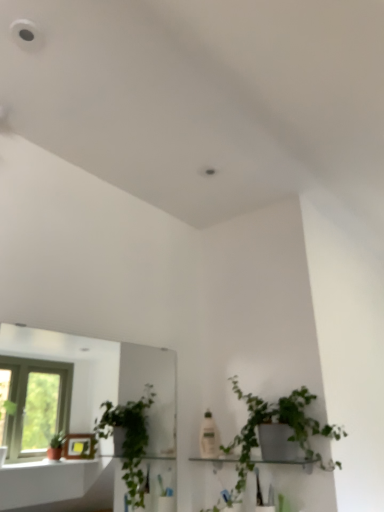
Question: From the image's perspective, is clear glass mirror at left beneath green matte plant at center-right?

Choices:
 (A) yes
 (B) no

Answer: (B)

Question: Considering the relative positions of clear glass mirror at left and green matte plant at center-right in the image provided, is clear glass mirror at left to the right of green matte plant at center-right from the viewer's perspective?

Choices:
 (A) yes
 (B) no

Answer: (B)

Question: Is clear glass mirror at left facing away from green matte plant at center-right?

Choices:
 (A) no
 (B) yes

Answer: (A)

Question: Is clear glass mirror at left next to green matte plant at center-right?

Choices:
 (A) no
 (B) yes

Answer: (A)

Question: Can you confirm if clear glass mirror at left is shorter than green matte plant at center-right?

Choices:
 (A) no
 (B) yes

Answer: (A)

Question: Based on their positions, is clear glass mirror at left located to the left or right of green matte plant at center-right?

Choices:
 (A) right
 (B) left

Answer: (B)

Question: From a real-world perspective, relative to green matte plant at center-right, is clear glass mirror at left vertically above or below?

Choices:
 (A) above
 (B) below

Answer: (A)

Question: Does point (82, 377) appear closer or farther from the camera than point (281, 411)?

Choices:
 (A) farther
 (B) closer

Answer: (A)

Question: Considering the positions of clear glass mirror at left and green matte plant at center-right in the image, is clear glass mirror at left wider or thinner than green matte plant at center-right?

Choices:
 (A) thin
 (B) wide

Answer: (A)

Question: Considering their positions, is white glossy shelf at center located in front of or behind clear glass mirror at left?

Choices:
 (A) front
 (B) behind

Answer: (B)

Question: Visually, is white glossy shelf at center positioned to the left or to the right of clear glass mirror at left?

Choices:
 (A) left
 (B) right

Answer: (B)

Question: Looking at the image, does white glossy shelf at center seem bigger or smaller compared to clear glass mirror at left?

Choices:
 (A) small
 (B) big

Answer: (A)

Question: Choose the correct answer: Is white glossy shelf at center inside clear glass mirror at left or outside it?

Choices:
 (A) inside
 (B) outside

Answer: (B)

Question: From the image's perspective, is clear glass mirror at left above or below white glossy shelf at center?

Choices:
 (A) above
 (B) below

Answer: (A)

Question: Relative to white glossy shelf at center, is clear glass mirror at left in front or behind?

Choices:
 (A) front
 (B) behind

Answer: (A)